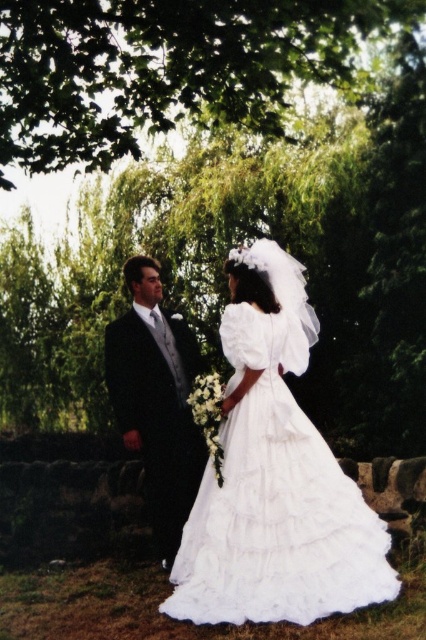
You are a photographer at a wedding. You need to adjust your camera to focus on the shiny black suit at left and the green leafy tree at upper center. Which object is closer to the camera?

The green leafy tree at upper center is closer to the camera because the shiny black suit at left is behind it.

You are a photographer at the wedding. You want to take a photo where the white satin dress at center is clearly visible without any obstruction from the green leafy tree at upper center. What should you do?

The white satin dress at center is behind the green leafy tree at upper center, so to make it visible, you should move the white satin dress at center forward or adjust the camera angle to avoid the obstruction from the green leafy tree at upper center.

You are a photographer at a wedding. You need to capture a photo that includes both the green leafy tree at upper center and the white satin dress at center. Based on their positions, which object is located to the left of the other?

The green leafy tree at upper center is positioned on the left side of white satin dress at center.